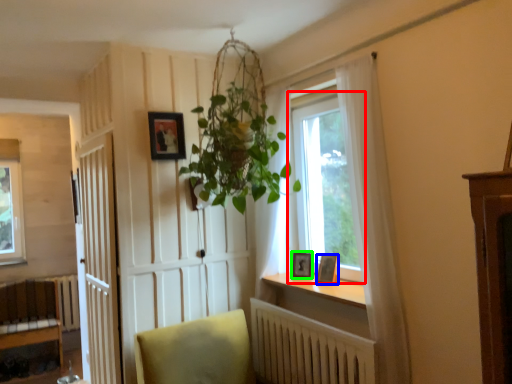
Question: Estimate the real-world distances between objects in this image. Which object is closer to window (highlighted by a red box), picture frame (highlighted by a blue box) or picture frame (highlighted by a green box)?

Choices:
 (A) picture frame
 (B) picture frame

Answer: (B)